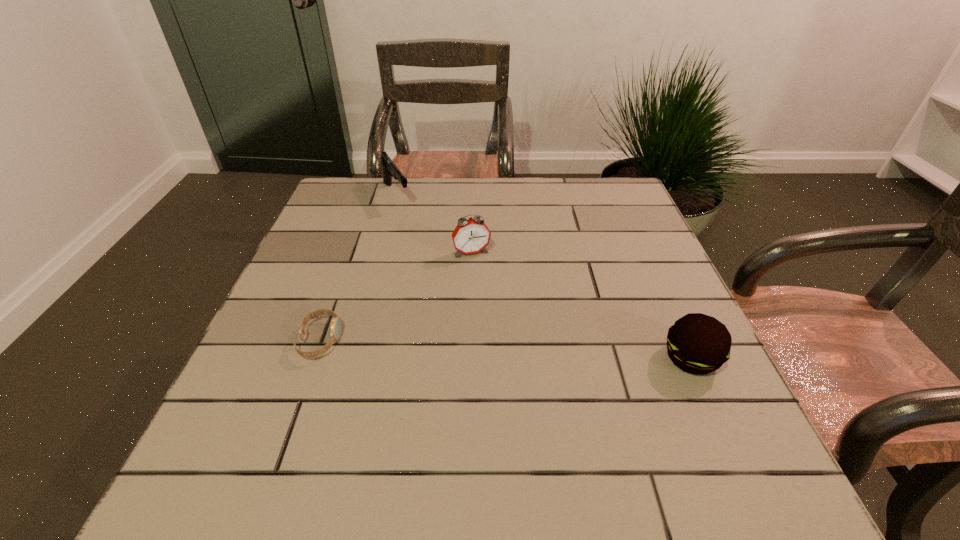
Locate an element on the screen. The image size is (960, 540). free space between the farthest object and the third object from left to right is located at coordinates (434, 224).

Where is `empty space that is in between the farthest object and the second object from right to left`? Image resolution: width=960 pixels, height=540 pixels. empty space that is in between the farthest object and the second object from right to left is located at coordinates (434, 224).

Image resolution: width=960 pixels, height=540 pixels. What are the coordinates of `free space between the third nearest object and the rightmost object` in the screenshot? It's located at (582, 305).

You are a GUI agent. You are given a task and a screenshot of the screen. Output one action in this format:
    pyautogui.click(x=<x>, y=<y>)
    Task: Click on the unoccupied area between the gun and the patty
    
    Given the screenshot: What is the action you would take?
    pyautogui.click(x=544, y=276)

Image resolution: width=960 pixels, height=540 pixels. Identify the location of blank region between the farthest object and the shortest object. (358, 267).

Where is `free spot between the gun and the third object from left to right`? free spot between the gun and the third object from left to right is located at coordinates (434, 224).

Find the location of a particular element. This screenshot has width=960, height=540. object that is the closest to the second farthest object is located at coordinates (390, 170).

Identify which object is located as the second nearest to the third tallest object. Please provide its 2D coordinates. Your answer should be formatted as a tuple, i.e. [(x, y)], where the tuple contains the x and y coordinates of a point satisfying the conditions above.

[(335, 334)]

Locate an element on the screen. free space that satisfies the following two spatial constraints: 1. on the front side of the alarm clock; 2. on the right side of the patty is located at coordinates (469, 358).

Find the location of a particular element. vacant space that satisfies the following two spatial constraints: 1. on the front side of the second shortest object; 2. on the left side of the alarm clock is located at coordinates (469, 358).